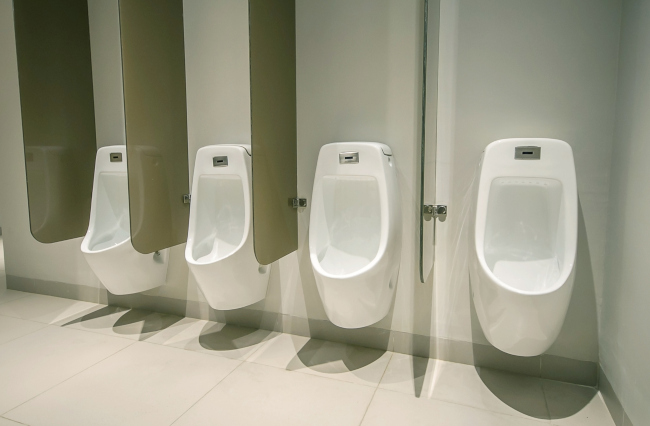
Where is `urinals`? The width and height of the screenshot is (650, 426). urinals is located at coordinates (116, 249), (229, 268), (356, 265), (517, 264).